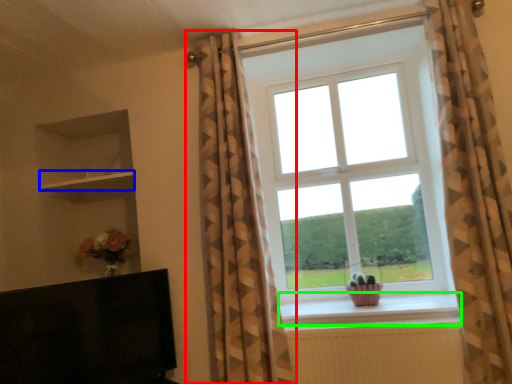
Question: Based on their relative distances, which object is nearer to curtain (highlighted by a red box)? Choose from shelf (highlighted by a blue box) and window sill (highlighted by a green box).

Choices:
 (A) shelf
 (B) window sill

Answer: (B)